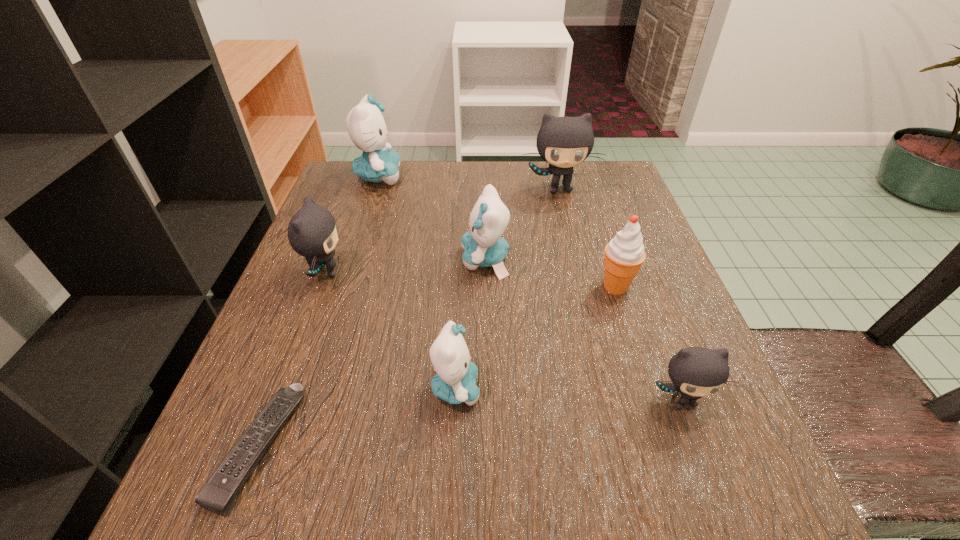
At what (x,y) coordinates should I click in order to perform the action: click on vacant space at the far left corner of the desktop. Please return your answer as a coordinate pair (x, y). The image size is (960, 540). Looking at the image, I should click on (372, 190).

Identify the location of free region at the near left corner of the desktop. (190, 501).

The height and width of the screenshot is (540, 960). In the image, there is a desktop. Find the location of `vacant space at the far right corner`. vacant space at the far right corner is located at coordinates (625, 206).

Image resolution: width=960 pixels, height=540 pixels. I want to click on blank space at the near right corner of the desktop, so click(x=784, y=535).

You are a GUI agent. You are given a task and a screenshot of the screen. Output one action in this format:
    pyautogui.click(x=<x>, y=<y>)
    Task: Click on the free space that is in between the nearest blue kitten and the leftmost gray kitten
    
    Given the screenshot: What is the action you would take?
    pyautogui.click(x=391, y=330)

Identify the location of vacant area that lies between the second nearest gray kitten and the shortest object. This screenshot has width=960, height=540. (292, 359).

Find the location of `unoccupied area between the smallest blue kitten and the second farthest blue kitten`. unoccupied area between the smallest blue kitten and the second farthest blue kitten is located at coordinates (470, 324).

Locate an element on the screen. Image resolution: width=960 pixels, height=540 pixels. vacant space in between the red icecream and the biggest gray kitten is located at coordinates (x=588, y=238).

Find the location of a particular element. empty location between the second farthest blue kitten and the biggest gray kitten is located at coordinates tap(522, 225).

Locate an element on the screen. vacant area between the nearest blue kitten and the biggest gray kitten is located at coordinates (507, 288).